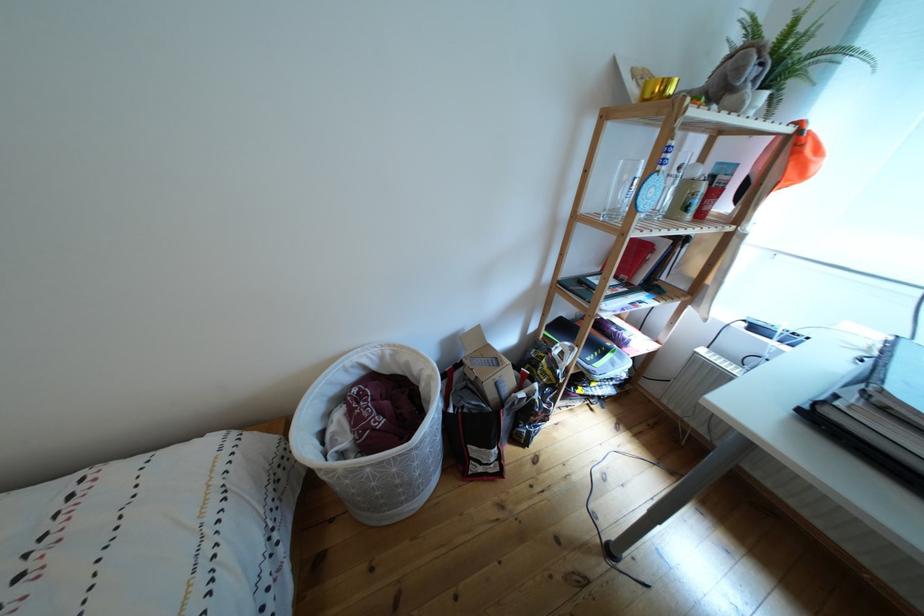
Where is `gray stuffed animal`? gray stuffed animal is located at coordinates [x=735, y=78].